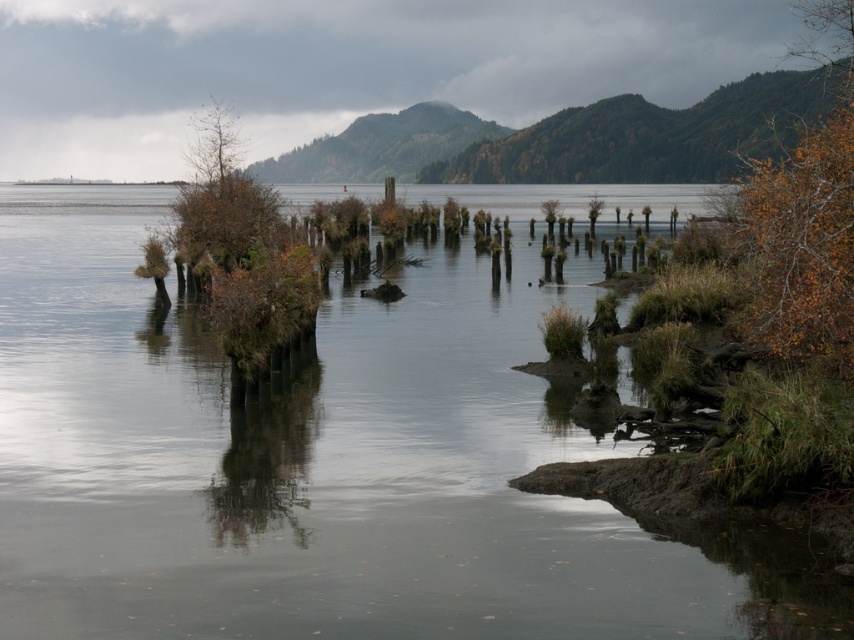
Question: Does brown matte tree at upper left appear on the right side of brown rough tree at center?

Choices:
 (A) no
 (B) yes

Answer: (A)

Question: Is clear water at center bigger than brown rough tree at center?

Choices:
 (A) no
 (B) yes

Answer: (B)

Question: Does clear water at center lie behind brown rough tree at center?

Choices:
 (A) no
 (B) yes

Answer: (A)

Question: Among these objects, which one is farthest from the camera?

Choices:
 (A) brown matte tree at upper left
 (B) brown rough tree at center
 (C) clear water at center

Answer: (B)

Question: Which of the following is the farthest from the observer?

Choices:
 (A) (430, 400)
 (B) (240, 236)
 (C) (603, 202)

Answer: (C)

Question: Which object is the closest to the brown matte tree at upper left?

Choices:
 (A) clear water at center
 (B) brown rough tree at center

Answer: (A)